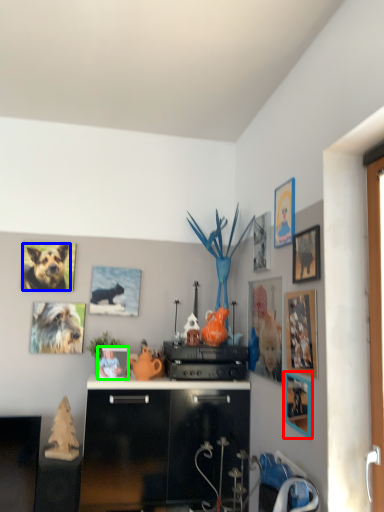
Question: Which object is positioned closest to picture frame (highlighted by a red box)? Select from dog (highlighted by a blue box) and picture frame (highlighted by a green box).

Choices:
 (A) dog
 (B) picture frame

Answer: (B)